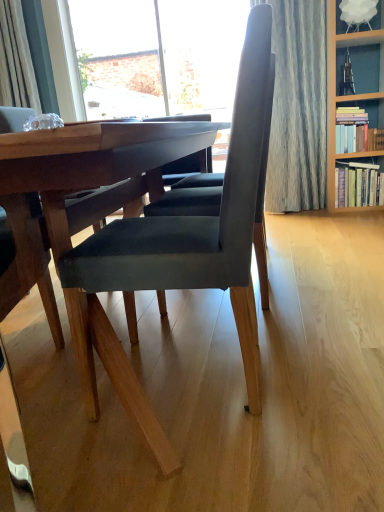
Question: From the image's perspective, is velvet dark gray chair at center located above or below hardcover books at upper right, the 1th book from the top?

Choices:
 (A) below
 (B) above

Answer: (A)

Question: In terms of width, does velvet dark gray chair at center look wider or thinner when compared to hardcover books at upper right, the 1th book from the top?

Choices:
 (A) thin
 (B) wide

Answer: (B)

Question: Which object is the farthest from the hardcover books at upper right, the 1th book from the top?

Choices:
 (A) hardcover book at right, the 1th book from the bottom
 (B) velvet dark gray chair at center
 (C) brick wall at upper left

Answer: (B)

Question: Estimate the real-world distances between objects in this image. Which object is farther from the velvet dark gray chair at center?

Choices:
 (A) hardcover book at right, the 1th book from the bottom
 (B) brick wall at upper left
 (C) hardcover books at upper right, the 1th book from the top

Answer: (B)